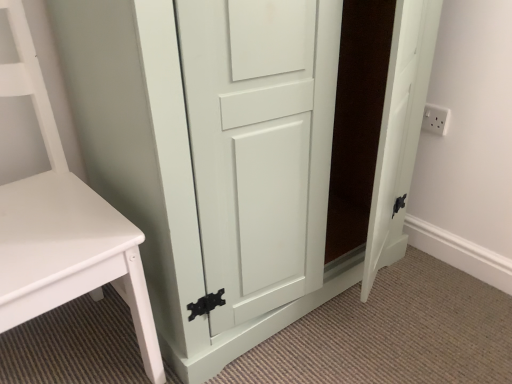
The image size is (512, 384). In order to click on white matte chair at left in this screenshot , I will do `click(56, 209)`.

Describe the element at coordinates (56, 209) in the screenshot. The height and width of the screenshot is (384, 512). I see `white matte chair at left` at that location.

I want to click on white matte chair at left, so click(x=56, y=209).